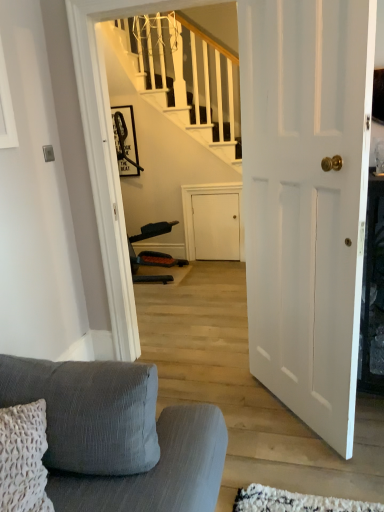
Question: Is textured gray fabric couch at lower left bigger or smaller than white matte door at center?

Choices:
 (A) big
 (B) small

Answer: (A)

Question: In the image, is textured gray fabric couch at lower left positioned in front of or behind white matte door at center?

Choices:
 (A) front
 (B) behind

Answer: (A)

Question: Which object is positioned farthest from the textured gray fabric couch at lower left?

Choices:
 (A) matte black picture frame at upper center
 (B) white matte door at center

Answer: (A)

Question: Which object is positioned closest to the matte black picture frame at upper center?

Choices:
 (A) textured gray fabric couch at lower left
 (B) white matte door at center

Answer: (B)